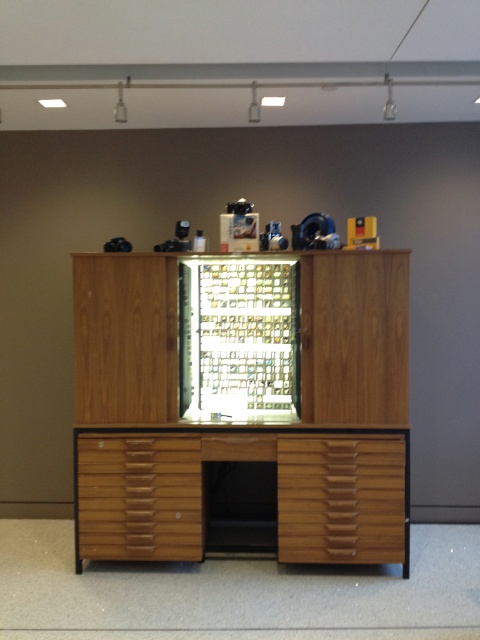
You are organizing a small item on the wooden cabinet. You have a metallic grid at center and a wooden file cabinet at center. Which one can you place a small item on top without it falling off?

The wooden file cabinet at center is larger in size than the metallic grid at center, so placing the small item on the wooden file cabinet at center would provide a more stable surface to prevent it from falling off.

You are moving a 12 inch wide box and need to place it between the wooden file cabinet at center and the metallic grid at center. Is there enough space?

The wooden file cabinet at center and metallic grid at center are 16.33 inches apart from each other. Since the box is 12 inches wide, there is enough space to place it between them.

You are organizing items on a wooden cabinet and need to place a 12 inch long object between the wooden file cabinet at center and the wooden drawer at center. Is there enough space?

The wooden file cabinet at center and wooden drawer at center are 10.92 inches apart from each other. Since the object is 12 inches long, it is longer than the available space between them. Therefore, there is not enough space to place the 12 inch long object between them.